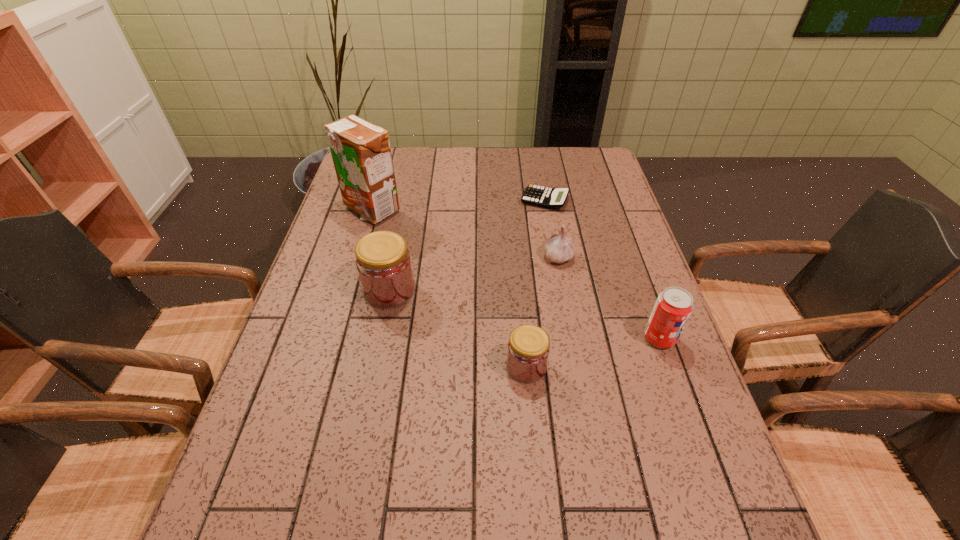
Select which object is the second closest to the carton. Please provide its 2D coordinates. Your answer should be formatted as a tuple, i.e. [(x, y)], where the tuple contains the x and y coordinates of a point satisfying the conditions above.

[(552, 198)]

Find the location of a particular element. The height and width of the screenshot is (540, 960). object that is the third closest to the tallest object is located at coordinates (558, 248).

This screenshot has height=540, width=960. What are the coordinates of `blank space that satisfies the following two spatial constraints: 1. on the front side of the taller jam; 2. on the right side of the soda can` in the screenshot? It's located at (380, 338).

What are the coordinates of `free space that satisfies the following two spatial constraints: 1. on the straw side of the fourth nearest object; 2. on the right side of the carton` in the screenshot? It's located at (357, 256).

The width and height of the screenshot is (960, 540). What are the coordinates of `vacant point that satisfies the following two spatial constraints: 1. on the back side of the right jam; 2. on the right side of the calculator` in the screenshot? It's located at (512, 200).

Find the location of a particular element. The width and height of the screenshot is (960, 540). vacant space that satisfies the following two spatial constraints: 1. on the straw side of the tallest object; 2. on the left side of the nearer jam is located at coordinates (325, 367).

Locate an element on the screen. The width and height of the screenshot is (960, 540). free spot that satisfies the following two spatial constraints: 1. on the back side of the third nearest object; 2. on the left side of the garlic is located at coordinates (396, 256).

Where is `free spot that satisfies the following two spatial constraints: 1. on the straw side of the tallest object; 2. on the left side of the fourth nearest object`? Image resolution: width=960 pixels, height=540 pixels. free spot that satisfies the following two spatial constraints: 1. on the straw side of the tallest object; 2. on the left side of the fourth nearest object is located at coordinates (357, 256).

Locate an element on the screen. The image size is (960, 540). vacant point that satisfies the following two spatial constraints: 1. on the straw side of the fourth nearest object; 2. on the left side of the carton is located at coordinates (357, 256).